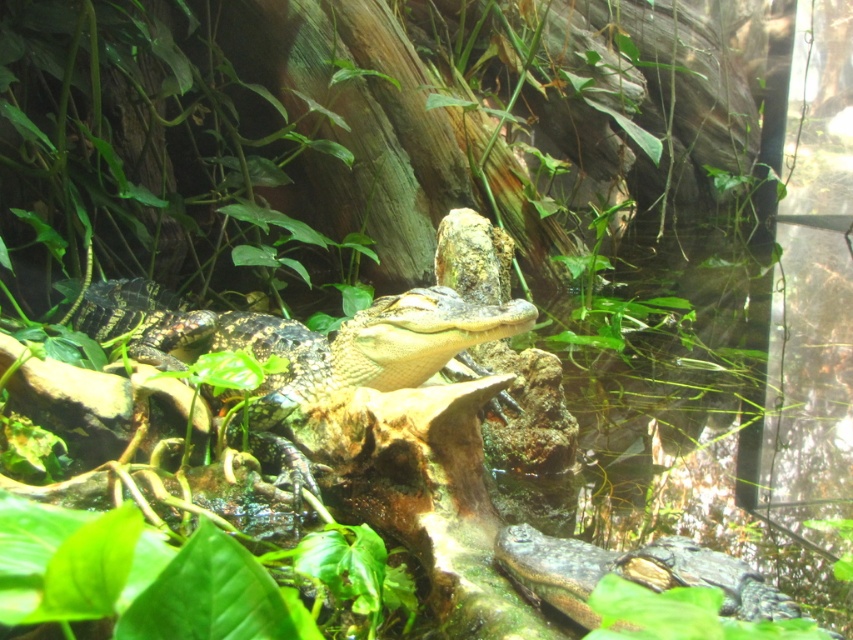
Consider the image. You are a zookeeper observing the crocodiles in their enclosure. You notice two crocodiles, the shiny green crocodile at center and the dark green scaly crocodile at lower right. Which one is positioned more to the left side of the enclosure?

The shiny green crocodile at center is positioned more to the left side of the enclosure compared to the dark green scaly crocodile at lower right.

You are a zookeeper responsible for feeding the crocodiles. You need to place a food container between the shiny green crocodile at center and the dark green scaly crocodile at lower right. The container requires a minimum of 3 feet of space to be safely placed. Can you safely place the container between them?

The shiny green crocodile at center is 3.31 feet from the dark green scaly crocodile at lower right. Since the required minimum space is 3 feet, the container can be safely placed between them as the distance is sufficient.

You are a zookeeper observing the reptile exhibit. You notice two crocodiles in the enclosure. Which crocodile, the shiny green crocodile at center or the dark green scaly crocodile at lower right, is bigger?

The shiny green crocodile at center is larger in size compared to the dark green scaly crocodile at lower right.